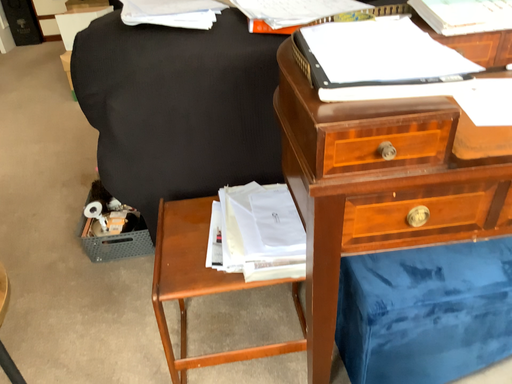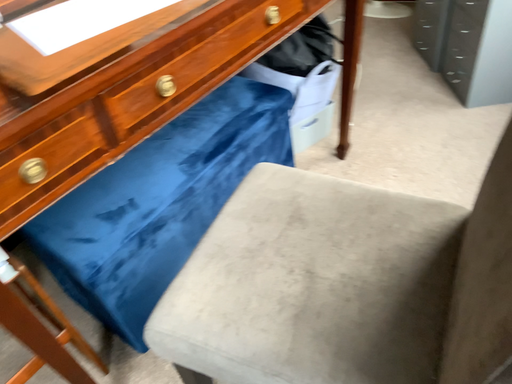
Question: How did the camera likely rotate when shooting the video?

Choices:
 (A) rotated left
 (B) rotated right

Answer: (B)